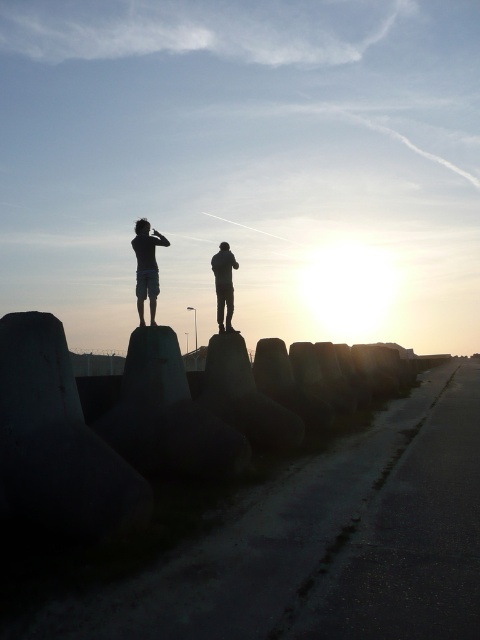
Question: Which of these objects is positioned closest to the silhouette human at center?

Choices:
 (A) silhouette figures at center
 (B) silhouette figure at center

Answer: (A)

Question: Is silhouette figures at center further to camera compared to silhouette figure at center?

Choices:
 (A) yes
 (B) no

Answer: (B)

Question: Which point is closer to the camera taking this photo?

Choices:
 (A) (143, 243)
 (B) (156, 276)
 (C) (225, 285)

Answer: (A)

Question: Which object appears closest to the camera in this image?

Choices:
 (A) silhouette figure at center
 (B) silhouette human at center

Answer: (B)

Question: Where is silhouette figures at center located in relation to silhouette figure at center in the image?

Choices:
 (A) right
 (B) left

Answer: (B)

Question: Can you confirm if silhouette figures at center is bigger than silhouette figure at center?

Choices:
 (A) yes
 (B) no

Answer: (A)